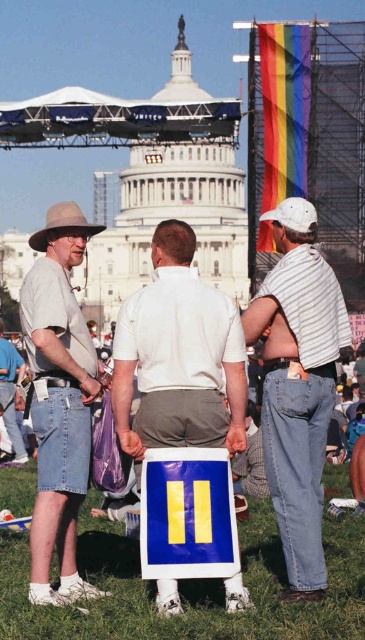
Question: Estimate the real-world distances between objects in this image. Which object is closer to the green grass at lower center?

Choices:
 (A) brown felt cowboy hat at left
 (B) denim shorts at left
 (C) striped cotton shirt at center

Answer: (B)

Question: Does denim shorts at left appear on the left side of brown felt cowboy hat at left?

Choices:
 (A) yes
 (B) no

Answer: (B)

Question: Which point is closer to the camera?

Choices:
 (A) green grass at lower center
 (B) denim shorts at left
 (C) striped cotton shirt at center

Answer: (A)

Question: Does striped cotton shirt at center appear over brown felt cowboy hat at left?

Choices:
 (A) yes
 (B) no

Answer: (B)

Question: Is white matte sign at center wider than denim shorts at left?

Choices:
 (A) yes
 (B) no

Answer: (A)

Question: Which of these objects is positioned closest to the striped cotton shirt at center?

Choices:
 (A) denim shorts at left
 (B) green grass at lower center

Answer: (B)